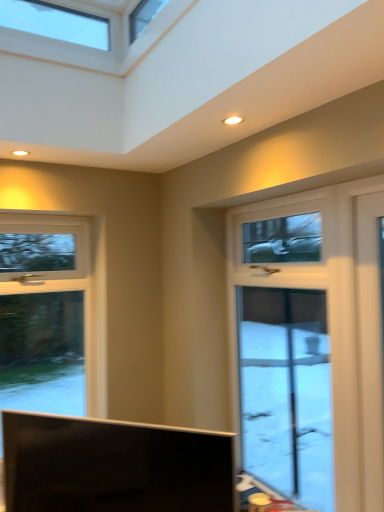
Question: Considering the relative sizes of white glossy door at right and matte black tv at lower center in the image provided, is white glossy door at right taller than matte black tv at lower center?

Choices:
 (A) no
 (B) yes

Answer: (B)

Question: Is white glossy door at right oriented away from matte black tv at lower center?

Choices:
 (A) yes
 (B) no

Answer: (B)

Question: From the image's perspective, does white glossy door at right appear lower than matte black tv at lower center?

Choices:
 (A) no
 (B) yes

Answer: (A)

Question: From a real-world perspective, is white glossy door at right physically below matte black tv at lower center?

Choices:
 (A) no
 (B) yes

Answer: (A)

Question: Could matte black tv at lower center be considered to be inside white glossy door at right?

Choices:
 (A) no
 (B) yes

Answer: (A)

Question: Is white glossy door at right directly adjacent to matte black tv at lower center?

Choices:
 (A) no
 (B) yes

Answer: (A)

Question: Is matte black tv at lower center completely or partially outside of white glossy door at right?

Choices:
 (A) yes
 (B) no

Answer: (A)

Question: From the image's perspective, is matte black tv at lower center located above white glossy door at right?

Choices:
 (A) yes
 (B) no

Answer: (B)

Question: From the image's perspective, is matte black tv at lower center under white glossy door at right?

Choices:
 (A) yes
 (B) no

Answer: (A)

Question: Considering the relative positions of matte black tv at lower center and white glossy door at right in the image provided, is matte black tv at lower center to the left of white glossy door at right from the viewer's perspective?

Choices:
 (A) no
 (B) yes

Answer: (B)

Question: Is matte black tv at lower center closer to the viewer compared to white glossy door at right?

Choices:
 (A) no
 (B) yes

Answer: (B)

Question: Is matte black tv at lower center shorter than white glossy door at right?

Choices:
 (A) no
 (B) yes

Answer: (B)

Question: Looking at the image, does white glossy door at right seem bigger or smaller compared to matte black tv at lower center?

Choices:
 (A) small
 (B) big

Answer: (A)